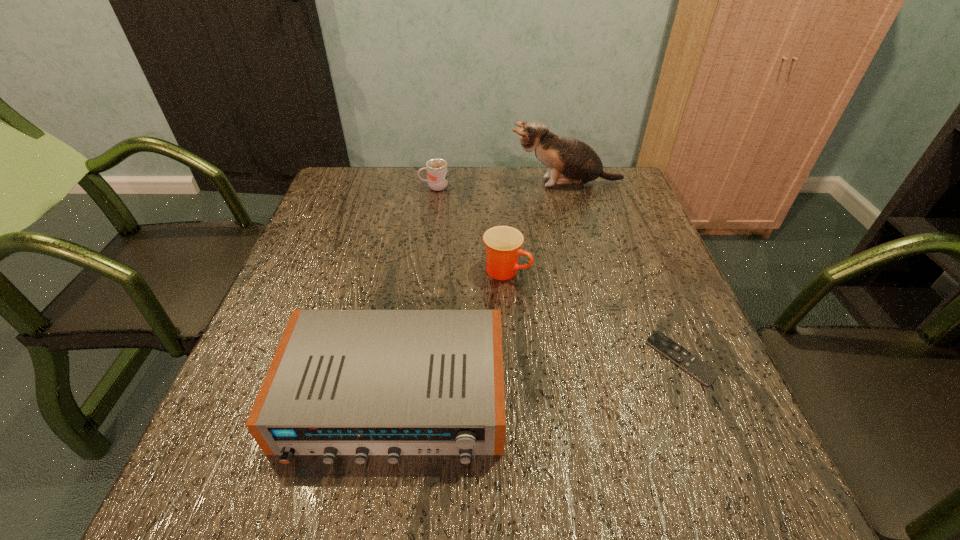
Find the location of `free space that satisfies the following two spatial constraints: 1. on the back side of the remote control; 2. at the face of the cat`. free space that satisfies the following two spatial constraints: 1. on the back side of the remote control; 2. at the face of the cat is located at coordinates [610, 183].

In order to click on free space that satisfies the following two spatial constraints: 1. at the face of the remote control; 2. on the right side of the tallest object in this screenshot , I will do `click(613, 358)`.

At what (x,y) coordinates should I click in order to perform the action: click on free location that satisfies the following two spatial constraints: 1. at the face of the cat; 2. on the right side of the remote control. Please return your answer as a coordinate pair (x, y). Looking at the image, I should click on (613, 358).